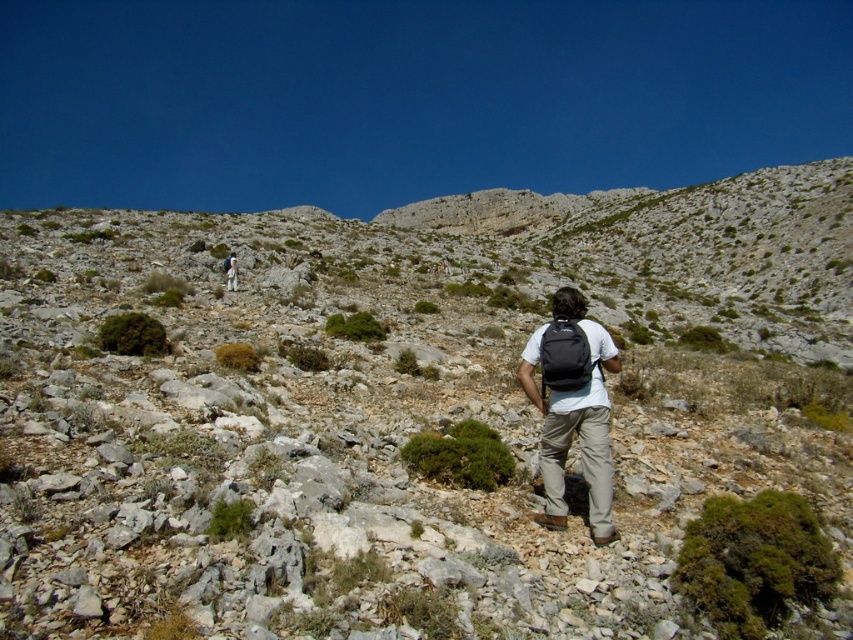
You are a hiker trying to navigate through the rocky terrain. You notice two bushes, the green mossy bush at lower right and the green leafy bush at lower left. Which bush is closer to you?

The green mossy bush at lower right is closer to you because it is positioned in front of the green leafy bush at lower left.

You are a hiker planning to place your matte black backpack at center on the ground near the green mossy bush at lower right. Considering their sizes, will the backpack fit entirely within the space occupied by the bush?

The green mossy bush at lower right is wider than the matte black backpack at center, so the backpack will fit entirely within the space occupied by the bush.

You are a hiker trying to navigate through the rocky terrain. You see a green shrub at center and a matte gray backpack at center. Which object is positioned to the right of the other?

The green shrub at center is to the right of the matte gray backpack at center.